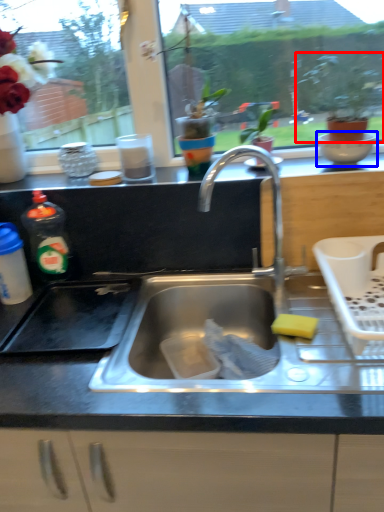
Question: Which point is further to the camera, houseplant (highlighted by a red box) or mixing bowl (highlighted by a blue box)?

Choices:
 (A) houseplant
 (B) mixing bowl

Answer: (B)